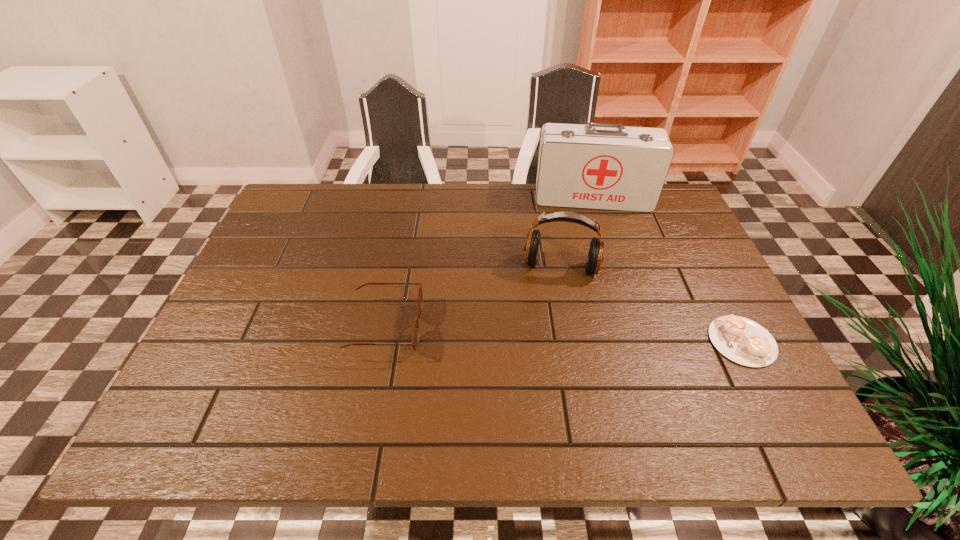
Find the location of a particular element. The image size is (960, 540). spectacles is located at coordinates (415, 337).

Where is `the third tallest object`? The width and height of the screenshot is (960, 540). the third tallest object is located at coordinates (415, 337).

In order to click on the shortest object in this screenshot , I will do `click(741, 340)`.

Where is `the tallest object`? The height and width of the screenshot is (540, 960). the tallest object is located at coordinates (606, 166).

At what (x,y) coordinates should I click in order to perform the action: click on the first-aid kit. Please return your answer as a coordinate pair (x, y). The image size is (960, 540). Looking at the image, I should click on (606, 166).

Identify the location of the third shortest object. This screenshot has width=960, height=540. (595, 256).

I want to click on headset, so click(x=595, y=256).

Image resolution: width=960 pixels, height=540 pixels. Find the location of `blank space located 0.240m at the front view of the spectacles`. blank space located 0.240m at the front view of the spectacles is located at coordinates (525, 328).

This screenshot has height=540, width=960. I want to click on free location located on the left of the cappuccino, so click(x=579, y=341).

The height and width of the screenshot is (540, 960). Identify the location of free point located on the front-facing side of the tallest object. (597, 261).